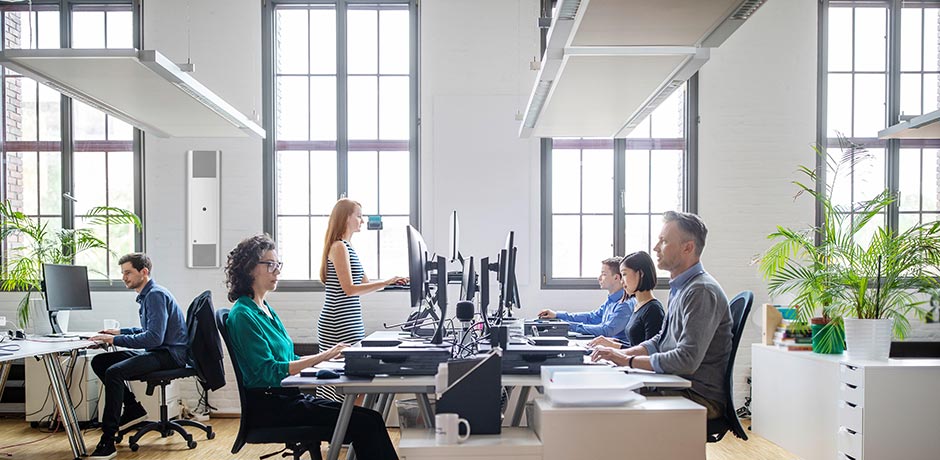
The image size is (940, 460). I want to click on windows, so click(x=19, y=30), click(x=325, y=40), click(x=664, y=147), click(x=880, y=94).